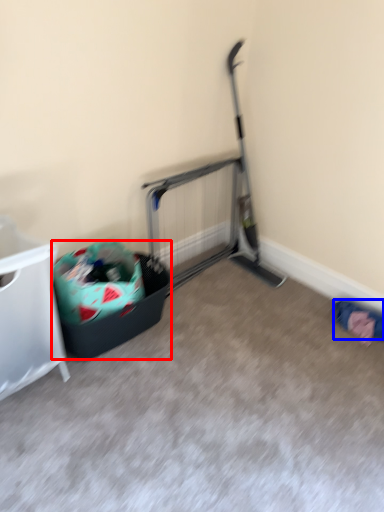
Question: Which point is closer to the camera, recycling bin (highlighted by a red box) or clothing (highlighted by a blue box)?

Choices:
 (A) recycling bin
 (B) clothing

Answer: (A)